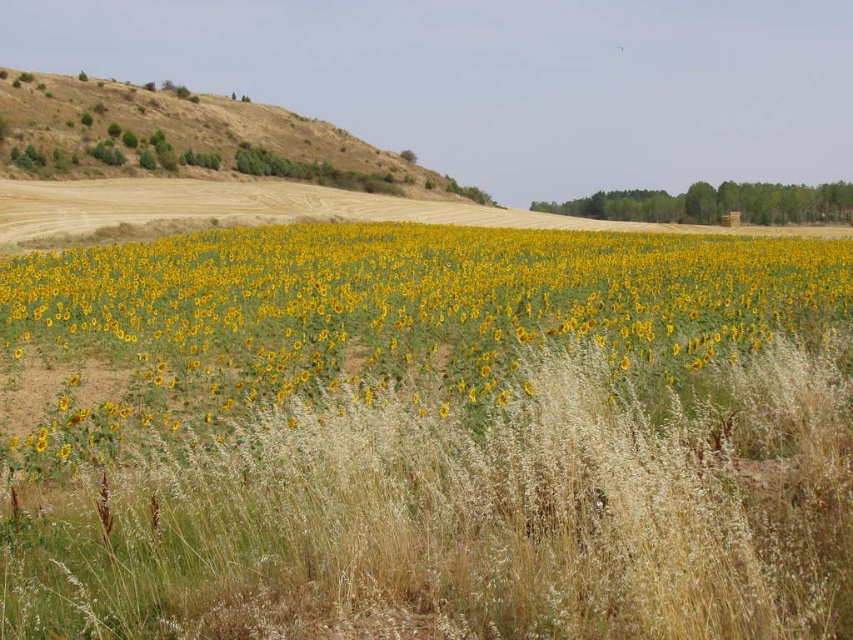
Question: Among these points, which one is farthest from the camera?

Choices:
 (A) (440, 176)
 (B) (178, 253)

Answer: (A)

Question: Is yellow matte sunflower at center to the right of brown/dry grass at upper left from the viewer's perspective?

Choices:
 (A) no
 (B) yes

Answer: (B)

Question: Among these objects, which one is farthest from the camera?

Choices:
 (A) yellow matte sunflower at center
 (B) brown/dry grass at upper left

Answer: (B)

Question: Is yellow matte sunflower at center above brown/dry grass at upper left?

Choices:
 (A) no
 (B) yes

Answer: (A)

Question: Can you confirm if yellow matte sunflower at center is bigger than brown/dry grass at upper left?

Choices:
 (A) no
 (B) yes

Answer: (A)